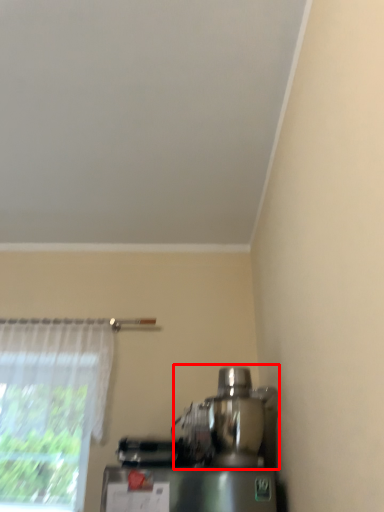
Question: From the image's perspective, what is the correct spatial relationship of mixer (annotated by the red box) in relation to curtain?

Choices:
 (A) above
 (B) below

Answer: (B)